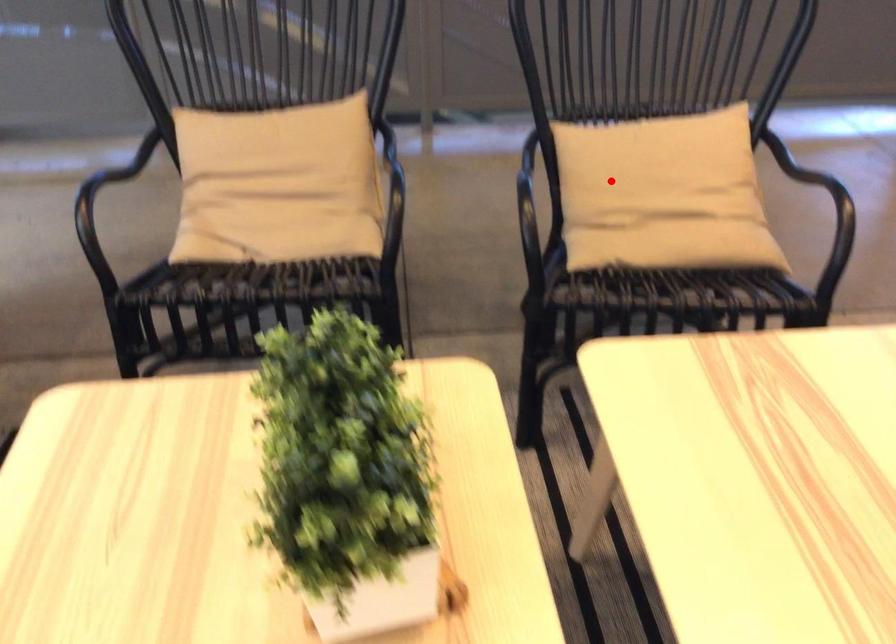
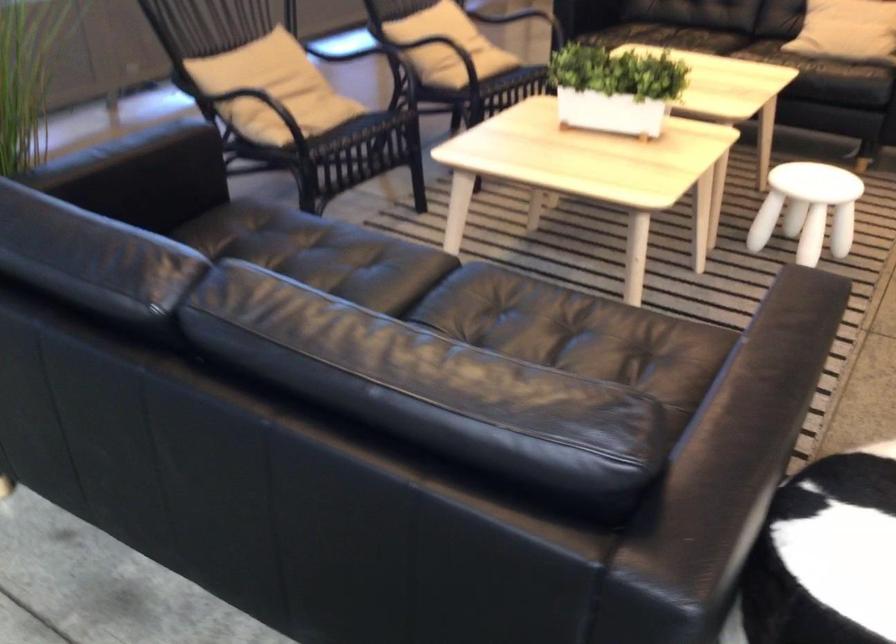
Where in the second image is the point corresponding to the highlighted location from the first image?

(433, 43)